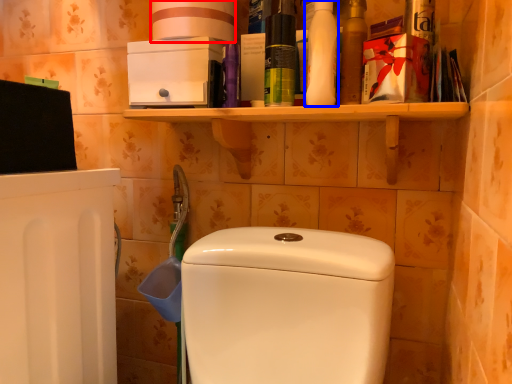
Question: Which object is closer to the camera taking this photo, toilet paper (highlighted by a red box) or cleaning product (highlighted by a blue box)?

Choices:
 (A) toilet paper
 (B) cleaning product

Answer: (B)